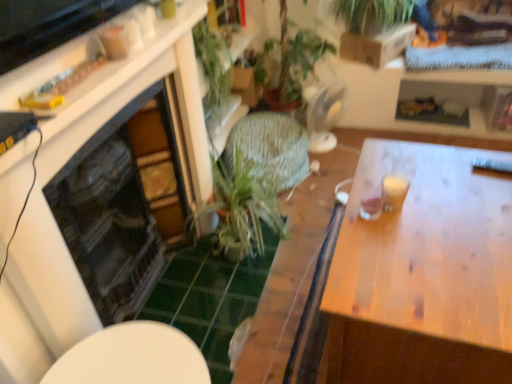
Question: Is wooden table at right surrounding green leafy plant at center?

Choices:
 (A) no
 (B) yes

Answer: (A)

Question: Is wooden table at right positioned in front of green leafy plant at center?

Choices:
 (A) yes
 (B) no

Answer: (A)

Question: Could you tell me if wooden table at right is turned towards green leafy plant at center?

Choices:
 (A) yes
 (B) no

Answer: (B)

Question: Can you confirm if wooden table at right is shorter than green leafy plant at center?

Choices:
 (A) no
 (B) yes

Answer: (A)

Question: Considering the relative positions of wooden table at right and green leafy plant at center in the image provided, is wooden table at right behind green leafy plant at center?

Choices:
 (A) no
 (B) yes

Answer: (A)

Question: Can you confirm if wooden table at right is wider than green leafy plant at center?

Choices:
 (A) no
 (B) yes

Answer: (B)

Question: Considering the relative sizes of green leafy plant at center and wooden table at right in the image provided, is green leafy plant at center thinner than wooden table at right?

Choices:
 (A) yes
 (B) no

Answer: (A)

Question: From the image's perspective, is green leafy plant at center beneath wooden table at right?

Choices:
 (A) no
 (B) yes

Answer: (A)

Question: Considering the relative sizes of green leafy plant at center and wooden table at right in the image provided, is green leafy plant at center taller than wooden table at right?

Choices:
 (A) no
 (B) yes

Answer: (A)

Question: Is green leafy plant at center further to the viewer compared to wooden table at right?

Choices:
 (A) no
 (B) yes

Answer: (B)

Question: Is green leafy plant at center far from wooden table at right?

Choices:
 (A) yes
 (B) no

Answer: (B)

Question: Considering the relative positions of green leafy plant at center and wooden table at right in the image provided, is green leafy plant at center in front of wooden table at right?

Choices:
 (A) no
 (B) yes

Answer: (A)

Question: Is green leafy plant at upper center wider than white glossy table at lower center?

Choices:
 (A) no
 (B) yes

Answer: (A)